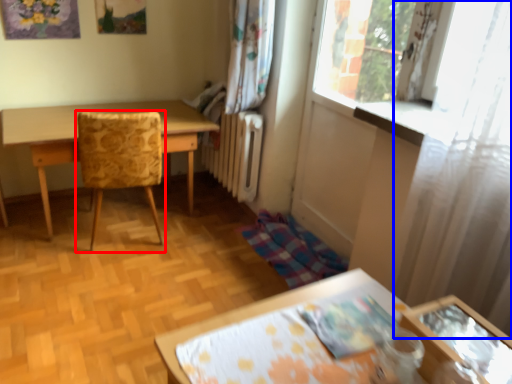
Question: Which of the following is the farthest to the observer, chair (highlighted by a red box) or curtain (highlighted by a blue box)?

Choices:
 (A) chair
 (B) curtain

Answer: (A)